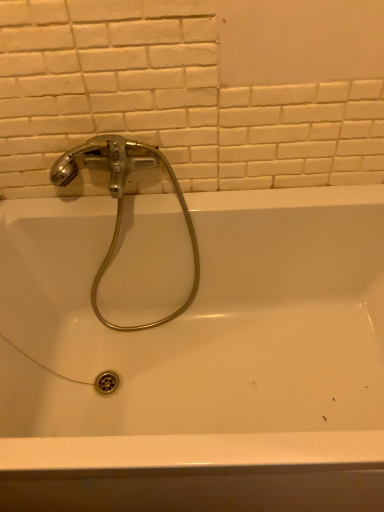
Question: Can you confirm if white matte ceramic tile at upper center is bigger than polished chrome faucet at upper left?

Choices:
 (A) no
 (B) yes

Answer: (A)

Question: Is white matte ceramic tile at upper center oriented away from polished chrome faucet at upper left?

Choices:
 (A) yes
 (B) no

Answer: (B)

Question: Is white matte ceramic tile at upper center to the left of polished chrome faucet at upper left from the viewer's perspective?

Choices:
 (A) yes
 (B) no

Answer: (B)

Question: Is polished chrome faucet at upper left inside white matte ceramic tile at upper center?

Choices:
 (A) no
 (B) yes

Answer: (A)

Question: Is white matte ceramic tile at upper center positioned before polished chrome faucet at upper left?

Choices:
 (A) no
 (B) yes

Answer: (B)

Question: From the image's perspective, does white matte ceramic tile at upper center appear lower than polished chrome faucet at upper left?

Choices:
 (A) yes
 (B) no

Answer: (B)

Question: Does white glossy bathtub at upper center have a smaller size compared to white matte ceramic tile at upper center?

Choices:
 (A) yes
 (B) no

Answer: (B)

Question: Could you tell me if white glossy bathtub at upper center is facing white matte ceramic tile at upper center?

Choices:
 (A) no
 (B) yes

Answer: (A)

Question: Can you confirm if white glossy bathtub at upper center is positioned to the left of white matte ceramic tile at upper center?

Choices:
 (A) no
 (B) yes

Answer: (A)

Question: Is white glossy bathtub at upper center at the right side of white matte ceramic tile at upper center?

Choices:
 (A) no
 (B) yes

Answer: (B)

Question: Considering the relative sizes of white glossy bathtub at upper center and white matte ceramic tile at upper center in the image provided, is white glossy bathtub at upper center shorter than white matte ceramic tile at upper center?

Choices:
 (A) yes
 (B) no

Answer: (B)

Question: Does white glossy bathtub at upper center lie in front of white matte ceramic tile at upper center?

Choices:
 (A) yes
 (B) no

Answer: (A)

Question: Does white matte ceramic tile at upper center have a larger size compared to white glossy bathtub at upper center?

Choices:
 (A) yes
 (B) no

Answer: (B)